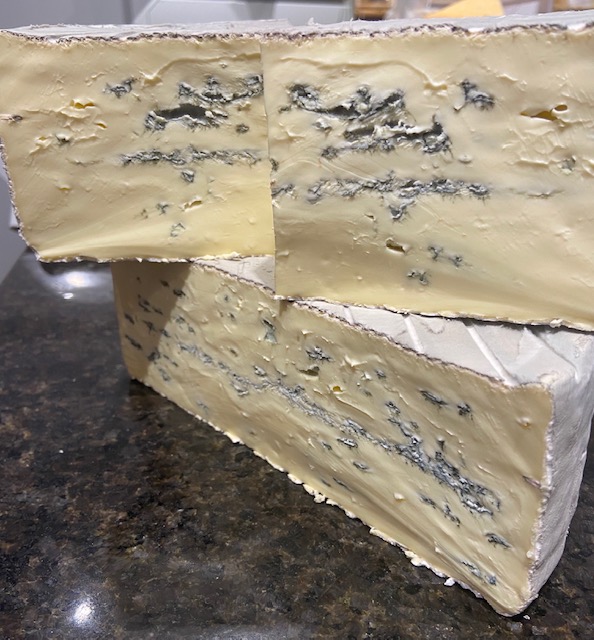
The width and height of the screenshot is (594, 640). I want to click on paper roll, so point(315,13).